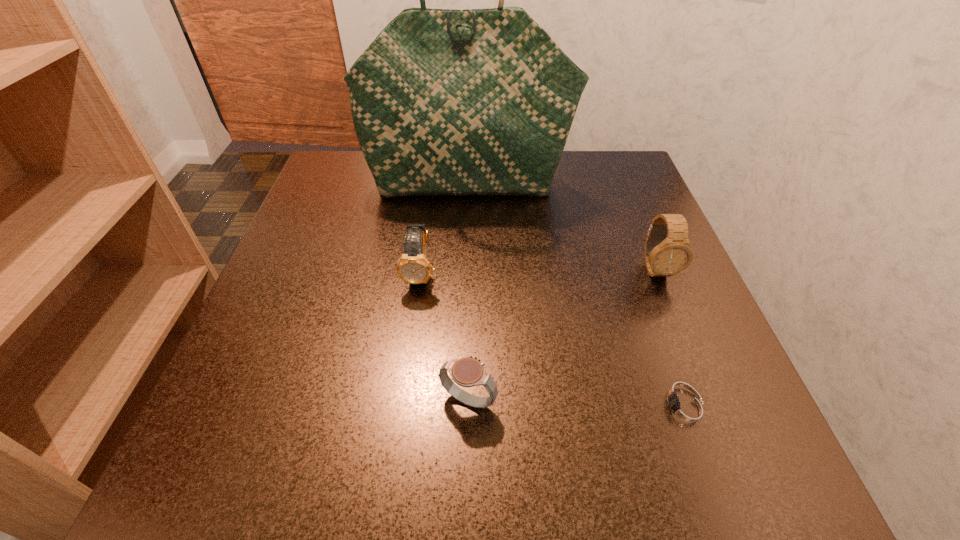
This screenshot has height=540, width=960. I want to click on tote bag, so click(444, 102).

This screenshot has width=960, height=540. I want to click on the farthest object, so click(x=444, y=102).

In order to click on the tallest watch in this screenshot , I will do `click(664, 257)`.

Where is `the third shortest watch`? the third shortest watch is located at coordinates (413, 267).

Where is `the leftmost watch`? the leftmost watch is located at coordinates click(x=413, y=267).

You are a GUI agent. You are given a task and a screenshot of the screen. Output one action in this format:
    pyautogui.click(x=<x>, y=<y>)
    Task: Click on the second shortest watch
    This screenshot has height=540, width=960.
    Given the screenshot: What is the action you would take?
    pyautogui.click(x=467, y=372)

Where is `the second watch from left to right`? The image size is (960, 540). the second watch from left to right is located at coordinates point(467,372).

Where is `the shortest watch`? the shortest watch is located at coordinates (684, 409).

You are a GUI agent. You are given a task and a screenshot of the screen. Output one action in this format:
    pyautogui.click(x=<x>, y=<y>)
    Task: Click on the vacant space located 0.330m on the front of the tote bag
    The height and width of the screenshot is (540, 960).
    Given the screenshot: What is the action you would take?
    pyautogui.click(x=464, y=321)

Where is `vacant region located 0.250m on the face of the tallest watch`? This screenshot has width=960, height=540. vacant region located 0.250m on the face of the tallest watch is located at coordinates click(715, 418).